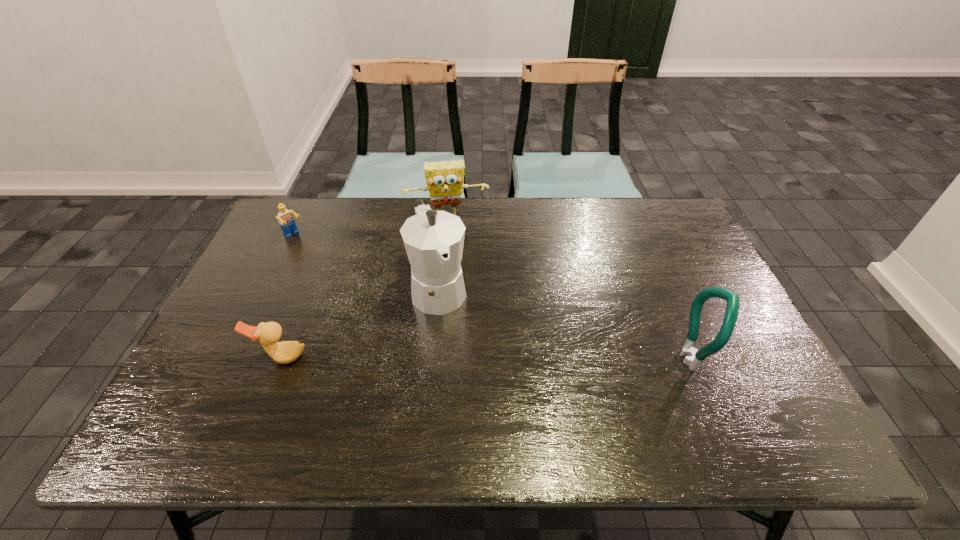
Locate an element on the screen. The image size is (960, 540). duck that is positioned at the left edge is located at coordinates (268, 334).

Find the location of a particular element. This screenshot has width=960, height=540. Lego at the left edge is located at coordinates (286, 221).

At what (x,y) coordinates should I click in order to perform the action: click on object present at the right edge. Please return your answer as a coordinate pair (x, y). This screenshot has width=960, height=540. Looking at the image, I should click on (693, 358).

Find the location of a particular element. object located in the far left corner section of the desktop is located at coordinates (286, 221).

The height and width of the screenshot is (540, 960). I want to click on object present at the near right corner, so click(x=693, y=358).

What are the coordinates of `free region at the far edge` in the screenshot? It's located at (476, 228).

This screenshot has width=960, height=540. In the image, there is a desktop. Identify the location of free space at the near edge. (669, 374).

In the image, there is a desktop. Identify the location of vacant space at the left edge. (214, 327).

In the image, there is a desktop. What are the coordinates of `vacant area at the right edge` in the screenshot? It's located at (682, 288).

The height and width of the screenshot is (540, 960). In the image, there is a desktop. What are the coordinates of `free space at the far left corner` in the screenshot? It's located at [x=316, y=233].